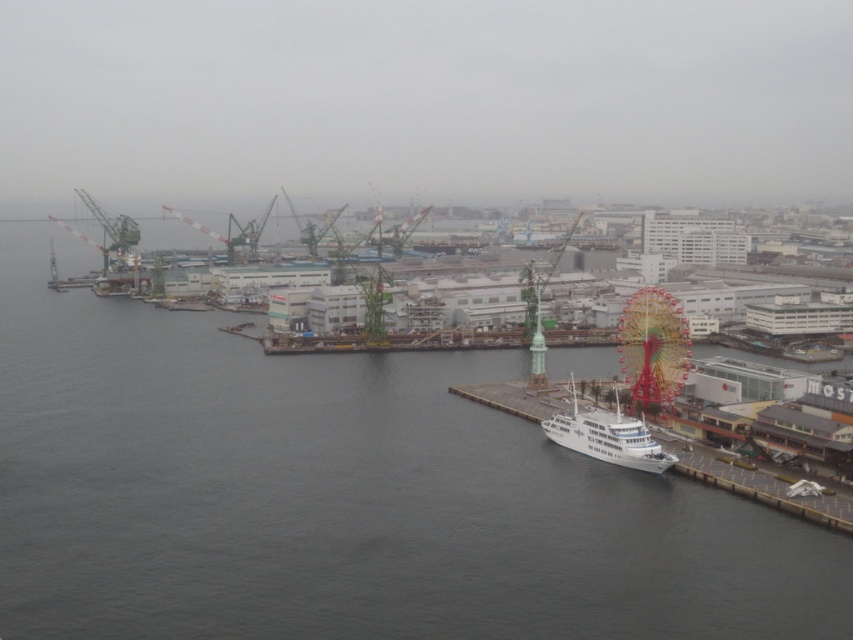
Who is taller, gray water at lower left or white glossy dock at lower right?

With more height is gray water at lower left.

Does point (393, 525) come behind point (699, 477)?

No, (393, 525) is closer to viewer.

Where is `gray water at lower left`? The image size is (853, 640). gray water at lower left is located at coordinates (341, 499).

Does gray water at lower left have a greater width compared to white glossy ship at lower right?

Yes.

Is point (447, 531) farther from viewer compared to point (607, 428)?

No, it is in front of (607, 428).

You are a GUI agent. You are given a task and a screenshot of the screen. Output one action in this format:
    pyautogui.click(x=<x>, y=<y>)
    Task: Click on the gray water at lower left
    Image resolution: width=853 pixels, height=640 pixels.
    Given the screenshot: What is the action you would take?
    pyautogui.click(x=341, y=499)

Does point (502, 397) come farther from viewer compared to point (628, 451)?

Yes, it is behind point (628, 451).

Based on the photo, between white glossy dock at lower right and white glossy ship at lower right, which one appears on the left side from the viewer's perspective?

Positioned to the left is white glossy ship at lower right.

Between point (831, 525) and point (618, 410), which one is positioned behind?

Point (618, 410)

At what (x,y) coordinates should I click in order to perform the action: click on white glossy dock at lower right. Please return your answer as a coordinate pair (x, y). Image resolution: width=853 pixels, height=640 pixels. Looking at the image, I should click on (762, 488).